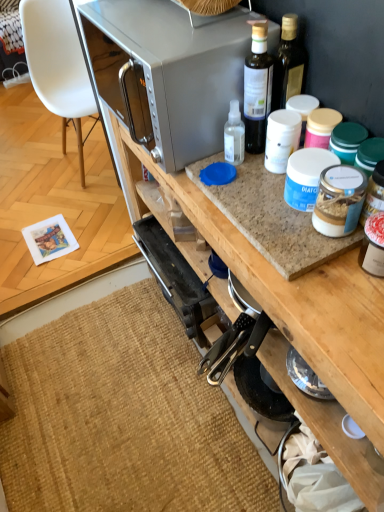
What are the coordinates of `free space in front of white plastic chair at left` in the screenshot? It's located at (75, 205).